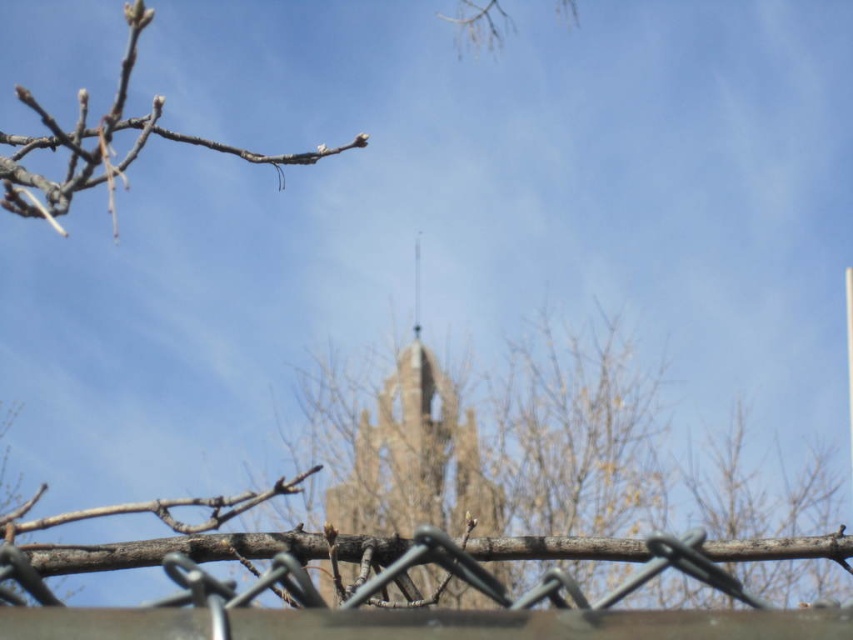
Does metallic wire fence at lower center lie behind bare wood branch at upper left?

No, it is not.

Does metallic wire fence at lower center appear on the left side of bare wood branch at upper left?

In fact, metallic wire fence at lower center is to the right of bare wood branch at upper left.

Is point (676, 618) farther from camera compared to point (109, 134)?

No, it is not.

Image resolution: width=853 pixels, height=640 pixels. What are the coordinates of `metallic wire fence at lower center` in the screenshot? It's located at (534, 624).